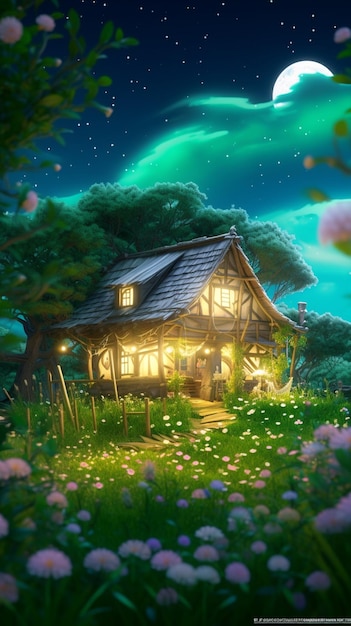
This screenshot has height=626, width=351. I want to click on lights, so click(x=207, y=340), click(x=132, y=342), click(x=61, y=345), click(x=222, y=352), click(x=256, y=370).